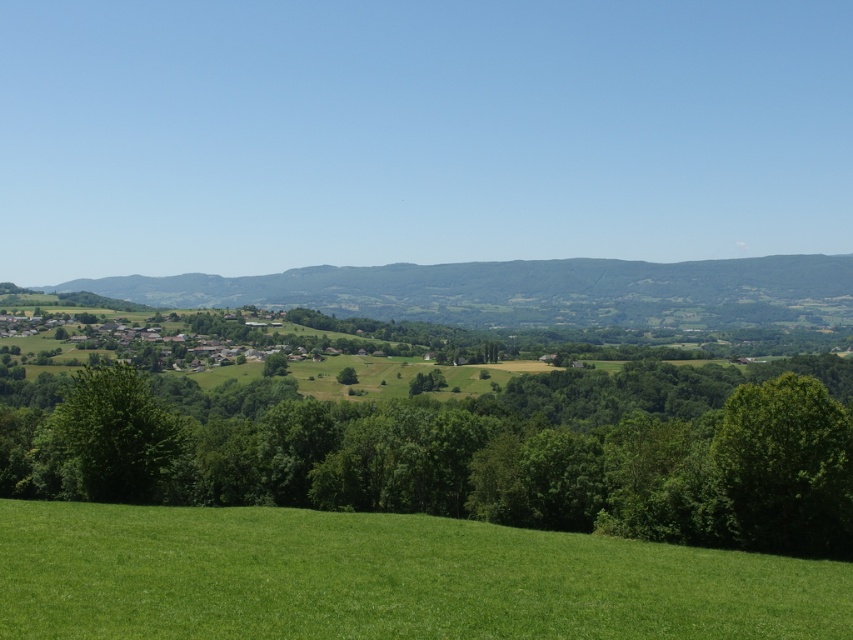
Is green leafy tree at center positioned before green leafy tree at lower left?

Yes.

Who is lower down, green leafy tree at center or green leafy tree at lower left?

green leafy tree at center is lower down.

Is point (114, 442) closer to camera compared to point (137, 445)?

Yes, it is in front of point (137, 445).

Identify the location of green leafy tree at center. This screenshot has height=640, width=853. (473, 456).

Does green leafy tree at center appear on the left side of green grassy field at lower center?

Indeed, green leafy tree at center is positioned on the left side of green grassy field at lower center.

Can you confirm if green leafy tree at center is positioned below green grassy field at lower center?

Indeed, green leafy tree at center is positioned under green grassy field at lower center.

Where is `green leafy tree at center`? The height and width of the screenshot is (640, 853). green leafy tree at center is located at coordinates (473, 456).

The image size is (853, 640). I want to click on green leafy tree at center, so click(x=473, y=456).

Who is more distant from viewer, (160, 499) or (830, 412)?

The point (160, 499) is behind.

Who is shorter, green leafy tree at center or green leafy tree at right?

green leafy tree at right

I want to click on green leafy tree at center, so click(x=473, y=456).